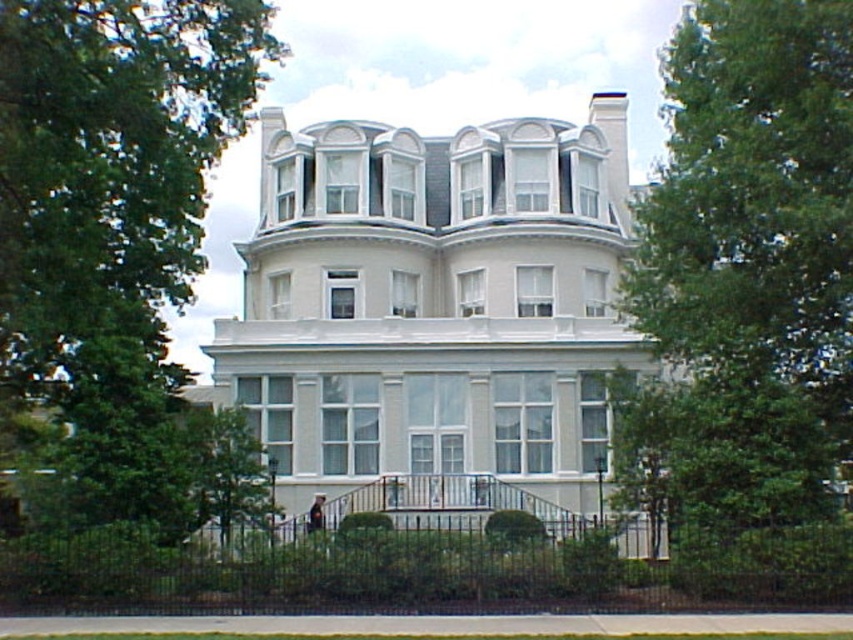
Which is behind, point (247, 285) or point (196, 426)?

The point (247, 285) is more distant.

Does white smooth mansion at center lie in front of green leafy tree at lower center?

No, it is not.

Is point (274, 326) positioned behind point (219, 420)?

Yes, point (274, 326) is behind point (219, 420).

At what (x,y) coordinates should I click in order to perform the action: click on white smooth mansion at center. Please return your answer as a coordinate pair (x, y). Looking at the image, I should click on (434, 308).

What are the coordinates of `white smooth mansion at center` in the screenshot? It's located at (434, 308).

Between white smooth mansion at center and green leafy tree at upper left, which one has less height?

green leafy tree at upper left is shorter.

Find the location of a particular element. The image size is (853, 640). white smooth mansion at center is located at coordinates (434, 308).

The width and height of the screenshot is (853, 640). Identify the location of white smooth mansion at center. (434, 308).

Is point (329, 288) farther from viewer compared to point (663, 451)?

Yes, it is behind point (663, 451).

Who is more forward, (448, 204) or (708, 380)?

Point (708, 380)

Image resolution: width=853 pixels, height=640 pixels. I want to click on white smooth mansion at center, so click(x=434, y=308).

The image size is (853, 640). Identify the location of white smooth mansion at center. (434, 308).